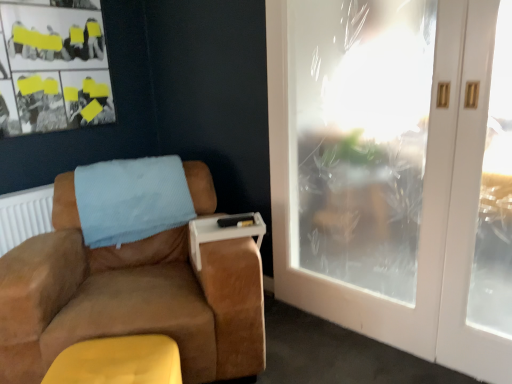
Identify the location of yellow suede footrest at lower left. This screenshot has width=512, height=384. (118, 361).

Describe the element at coordinates (131, 199) in the screenshot. I see `light blue textured blanket at upper left` at that location.

Find the location of a particular element. This screenshot has height=384, width=512. suede brown armchair at left is located at coordinates (130, 298).

Identify the location of matte black bulletin board at upper left. (53, 69).

Locate an element on the screen. white frosted glass door at right is located at coordinates (395, 173).

Find the location of a particular element. This screenshot has width=512, height=384. yellow suede footrest at lower left is located at coordinates (118, 361).

From a real-world perspective, is white frosted glass door at right on yellow suede footrest at lower left?

Correct, in the physical world, white frosted glass door at right is higher than yellow suede footrest at lower left.

Which object is wider, white frosted glass door at right or yellow suede footrest at lower left?

Wider between the two is yellow suede footrest at lower left.

Which object is closer to the camera, white frosted glass door at right or yellow suede footrest at lower left?

yellow suede footrest at lower left is in front.

Does white frosted glass door at right appear on the right side of yellow suede footrest at lower left?

Indeed, white frosted glass door at right is positioned on the right side of yellow suede footrest at lower left.

Can you tell me how much matte black bulletin board at upper left and yellow suede footrest at lower left differ in facing direction?

44.2 degrees.

Considering the positions of objects matte black bulletin board at upper left and yellow suede footrest at lower left in the image provided, who is more to the left, matte black bulletin board at upper left or yellow suede footrest at lower left?

From the viewer's perspective, matte black bulletin board at upper left appears more on the left side.

From a real-world perspective, who is located lower, matte black bulletin board at upper left or yellow suede footrest at lower left?

yellow suede footrest at lower left.

Can you confirm if yellow suede footrest at lower left is wider than white frosted glass door at right?

Correct, the width of yellow suede footrest at lower left exceeds that of white frosted glass door at right.

Between yellow suede footrest at lower left and white frosted glass door at right, which one has more height?

white frosted glass door at right.

Is yellow suede footrest at lower left looking in the opposite direction of white frosted glass door at right?

No.

Is yellow suede footrest at lower left next to white frosted glass door at right?

They are not placed beside each other.

Looking at this image, is suede brown armchair at left positioned beyond the bounds of yellow suede footrest at lower left?

Indeed, suede brown armchair at left is completely outside yellow suede footrest at lower left.

Which point is more distant from viewer, (220, 379) or (134, 342)?

Positioned behind is point (220, 379).

You are a GUI agent. You are given a task and a screenshot of the screen. Output one action in this format:
    pyautogui.click(x=<x>, y=<y>)
    Task: Click on the footrest in front of the suede brown armchair at left
    
    Given the screenshot: What is the action you would take?
    pyautogui.click(x=118, y=361)

How different are the orientations of matte black bulletin board at upper left and light blue textured blanket at upper left in degrees?

They differ by 37.5 degrees in their facing directions.

Who is shorter, matte black bulletin board at upper left or light blue textured blanket at upper left?

light blue textured blanket at upper left is shorter.

Image resolution: width=512 pixels, height=384 pixels. In order to click on blanket that is under the matte black bulletin board at upper left (from a real-world perspective) in this screenshot , I will do `click(131, 199)`.

Between point (42, 24) and point (102, 225), which one is positioned in front?

Positioned in front is point (102, 225).

Looking at this image, which point is more forward, (121, 160) or (279, 74)?

The point (279, 74) is closer to the camera.

How distant is light blue textured blanket at upper left from white frosted glass door at right?

light blue textured blanket at upper left and white frosted glass door at right are 3.42 feet apart from each other.

From the picture: From a real-world perspective, which is physically above, light blue textured blanket at upper left or white frosted glass door at right?

white frosted glass door at right is physically above.

Does light blue textured blanket at upper left lie behind white frosted glass door at right?

Yes, it is behind white frosted glass door at right.

Does white frosted glass door at right have a smaller size compared to matte black bulletin board at upper left?

Actually, white frosted glass door at right might be larger than matte black bulletin board at upper left.

Which object is positioned more to the left, white frosted glass door at right or matte black bulletin board at upper left?

matte black bulletin board at upper left.

Which is behind, point (411, 69) or point (106, 118)?

Positioned behind is point (411, 69).

Looking at their sizes, would you say white frosted glass door at right is wider or thinner than matte black bulletin board at upper left?

white frosted glass door at right is wider than matte black bulletin board at upper left.

This screenshot has height=384, width=512. Find the location of `door above the yellow suede footrest at lower left (from a real-world perspective)`. door above the yellow suede footrest at lower left (from a real-world perspective) is located at coordinates (395, 173).

This screenshot has width=512, height=384. Identify the location of bulletin board on the left side of yellow suede footrest at lower left. (53, 69).

From the image, which object appears to be nearer to white frosted glass door at right, yellow suede footrest at lower left or light blue textured blanket at upper left?

light blue textured blanket at upper left is positioned closer to the anchor white frosted glass door at right.

When comparing their distances from white plastic tray at armrest, does white frosted glass door at right or yellow suede footrest at lower left seem closer?

The object closer to white plastic tray at armrest is yellow suede footrest at lower left.

From the image, which object appears to be nearer to matte black bulletin board at upper left, white plastic tray at armrest or yellow suede footrest at lower left?

white plastic tray at armrest.

Looking at the image, which one is located closer to light blue textured blanket at upper left, white frosted glass door at right or white plastic tray at armrest?

white plastic tray at armrest is closer to light blue textured blanket at upper left.

Based on their spatial positions, is yellow suede footrest at lower left or suede brown armchair at left closer to white plastic tray at armrest?

Among the two, suede brown armchair at left is located nearer to white plastic tray at armrest.

Based on their spatial positions, is light blue textured blanket at upper left or matte black bulletin board at upper left closer to yellow suede footrest at lower left?

Among the two, light blue textured blanket at upper left is located nearer to yellow suede footrest at lower left.

Looking at the image, which one is located closer to matte black bulletin board at upper left, white plastic tray at armrest or light blue textured blanket at upper left?

The object closer to matte black bulletin board at upper left is light blue textured blanket at upper left.

Which object lies nearer to the anchor point suede brown armchair at left, yellow suede footrest at lower left or white plastic tray at armrest?

The object closer to suede brown armchair at left is yellow suede footrest at lower left.

At what (x,y) coordinates should I click in order to perform the action: click on table that lies between matte black bulletin board at upper left and yellow suede footrest at lower left from top to bottom. Please return your answer as a coordinate pair (x, y). The image size is (512, 384). Looking at the image, I should click on (223, 231).

Image resolution: width=512 pixels, height=384 pixels. I want to click on chair between matte black bulletin board at upper left and white frosted glass door at right, so click(x=130, y=298).

Locate an element on the screen. chair located between yellow suede footrest at lower left and light blue textured blanket at upper left in the depth direction is located at coordinates (130, 298).

You are a GUI agent. You are given a task and a screenshot of the screen. Output one action in this format:
    pyautogui.click(x=<x>, y=<y>)
    Task: Click on the table located between light blue textured blanket at upper left and white frosted glass door at right in the left-right direction
    Image resolution: width=512 pixels, height=384 pixels.
    Given the screenshot: What is the action you would take?
    pyautogui.click(x=223, y=231)